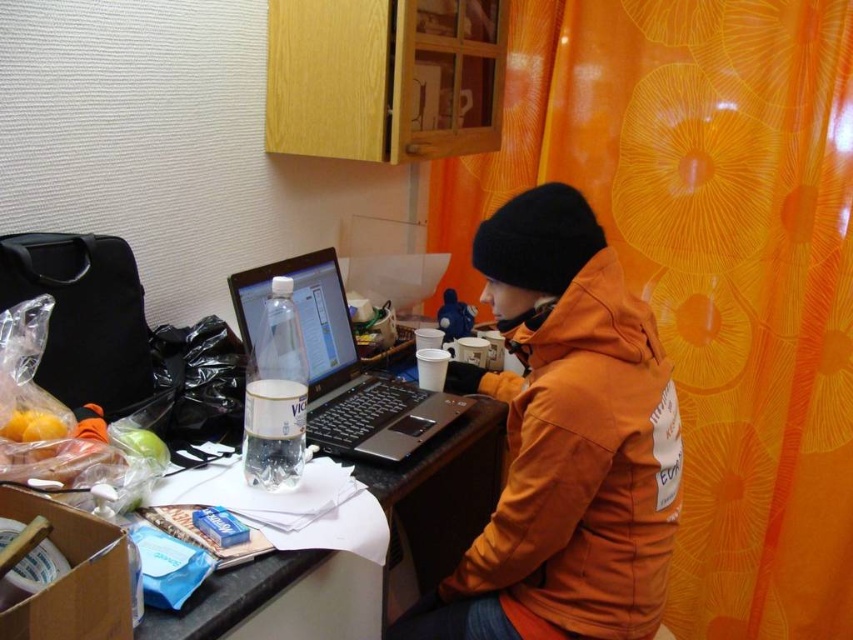
Question: Which object is the closest to the orange floral curtain at upper right?

Choices:
 (A) black plastic laptop at center
 (B) orange puffy jacket at center

Answer: (B)

Question: Which point is closer to the camera taking this photo?

Choices:
 (A) (299, 262)
 (B) (461, 586)

Answer: (B)

Question: Which point is closer to the camera taking this photo?

Choices:
 (A) (747, 444)
 (B) (392, 435)
 (C) (531, 449)

Answer: (C)

Question: Can you confirm if orange floral curtain at upper right is positioned to the right of black plastic laptop at center?

Choices:
 (A) no
 (B) yes

Answer: (B)

Question: Does orange floral curtain at upper right appear under orange puffy jacket at center?

Choices:
 (A) yes
 (B) no

Answer: (B)

Question: Does orange floral curtain at upper right have a smaller size compared to black plastic laptop at center?

Choices:
 (A) no
 (B) yes

Answer: (A)